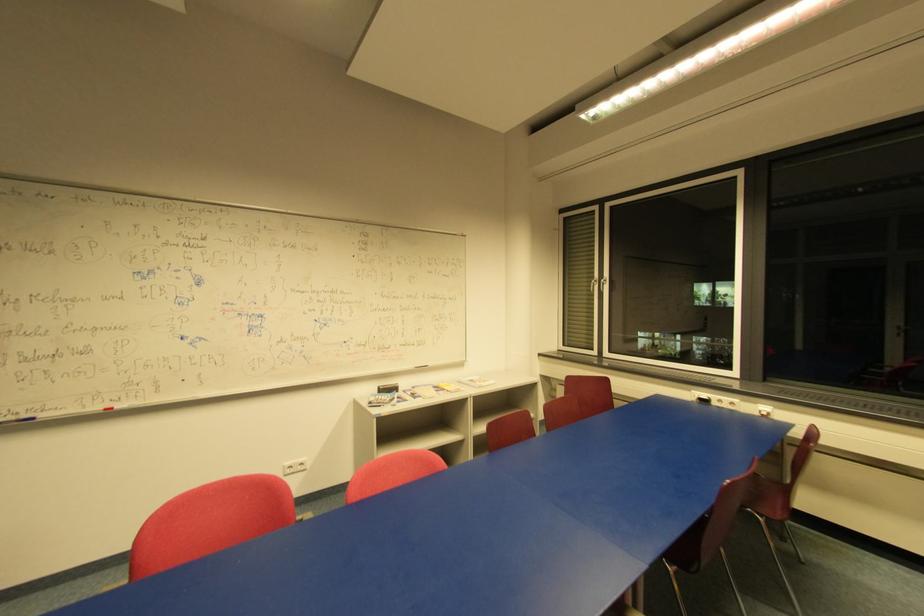
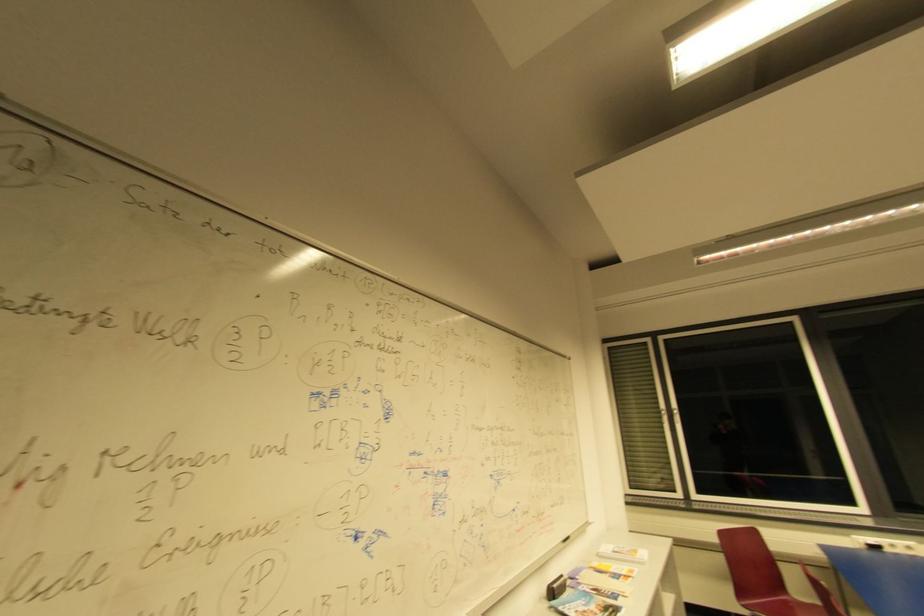
Which direction would the cameraman need to move to produce the second image?

The cameraman moved toward left, forward.